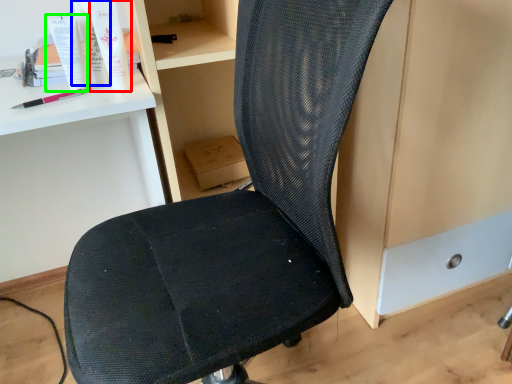
Question: Which object is positioned closest to toiletry (highlighted by a red box)? Select from toiletry (highlighted by a blue box) and toothpaste (highlighted by a green box).

Choices:
 (A) toiletry
 (B) toothpaste

Answer: (A)